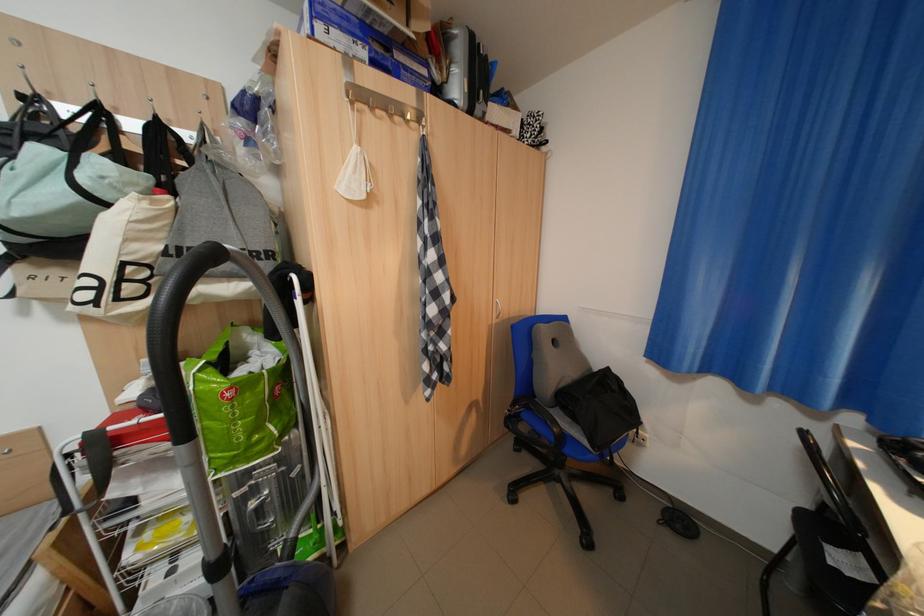
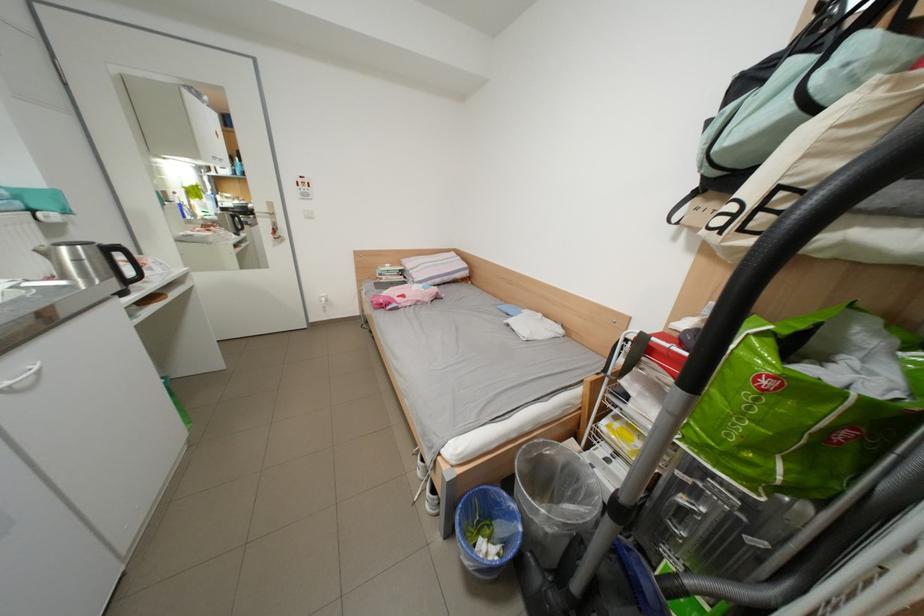
In the second image, find the point that corresponds to point (175, 236) in the first image.

(877, 146)